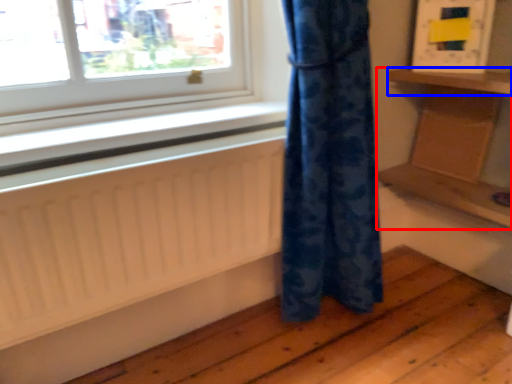
Question: Among these objects, which one is farthest to the camera, furniture (highlighted by a red box) or shelf (highlighted by a blue box)?

Choices:
 (A) furniture
 (B) shelf

Answer: (A)